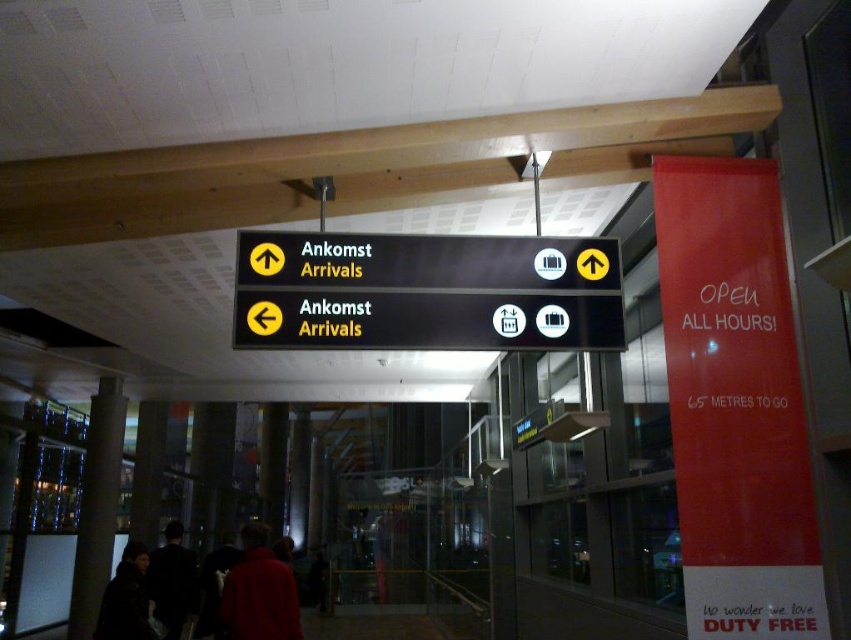
You are standing in the airport terminal and see the point marked at coordinates (260, 592). What object is located at that point?

The red fabric jacket at lower center is located at point (260, 592).

You are standing at the origin point of the coordinate system in the airport terminal. The black matte sign at center is located at point 0.456, 0.502. If you want to reach the arrivals area, which direction should you move relative to your current position?

The black matte sign at center is positioned at point (426, 291). Since the sign points upwards and to the left for arrivals, you should move in the direction indicated by the arrows on the sign towards arrivals.

In the scene shown: You are standing in the airport terminal and see the black matte sign at center and the dark fabric jacket at center. Which object is shorter?

The black matte sign at center is shorter than the dark fabric jacket at center.